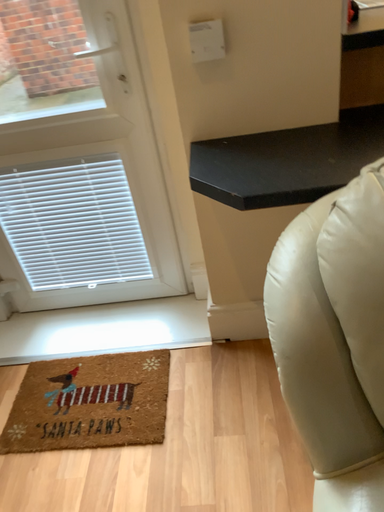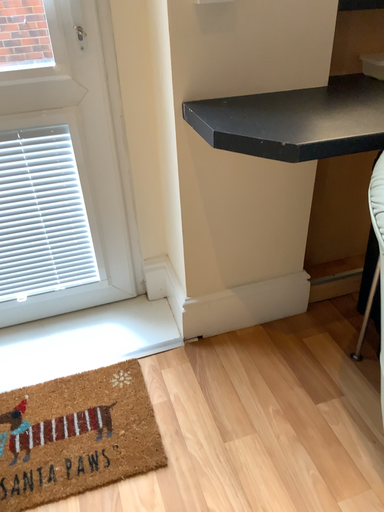
Question: How did the camera likely rotate when shooting the video?

Choices:
 (A) rotated right
 (B) rotated left

Answer: (A)